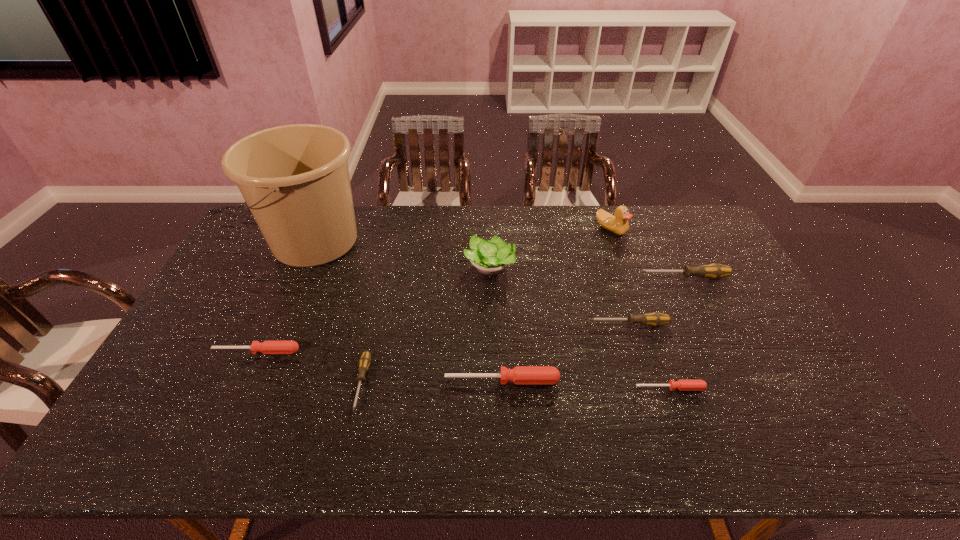
The width and height of the screenshot is (960, 540). Identify the location of free space at the near left corner of the desktop. (160, 437).

This screenshot has height=540, width=960. Identify the location of free space at the far right corner. (663, 222).

What are the coordinates of `free spot between the bucket and the green lettuce` in the screenshot? It's located at (402, 254).

At what (x,y) coordinates should I click in order to perform the action: click on free area in between the farthest screwdriver and the second smallest red screwdriver. Please return your answer as a coordinate pair (x, y). The image size is (960, 540). Looking at the image, I should click on (470, 314).

I want to click on empty space that is in between the tallest object and the second biggest red screwdriver, so click(x=286, y=296).

Where is `vacant region between the tallest object and the second biggest red screwdriver`? This screenshot has width=960, height=540. vacant region between the tallest object and the second biggest red screwdriver is located at coordinates (286, 296).

This screenshot has height=540, width=960. Find the location of `vacant space that's between the tallest object and the fifth nearest screwdriver`. vacant space that's between the tallest object and the fifth nearest screwdriver is located at coordinates (472, 283).

This screenshot has width=960, height=540. I want to click on vacant area that lies between the shortest object and the fourth screwdriver from right to left, so click(587, 384).

Image resolution: width=960 pixels, height=540 pixels. Find the location of `vacant space that's between the sixth shortest object and the shortest screwdriver`. vacant space that's between the sixth shortest object and the shortest screwdriver is located at coordinates (677, 333).

The height and width of the screenshot is (540, 960). I want to click on vacant space in between the duck and the beige bucket, so click(x=463, y=235).